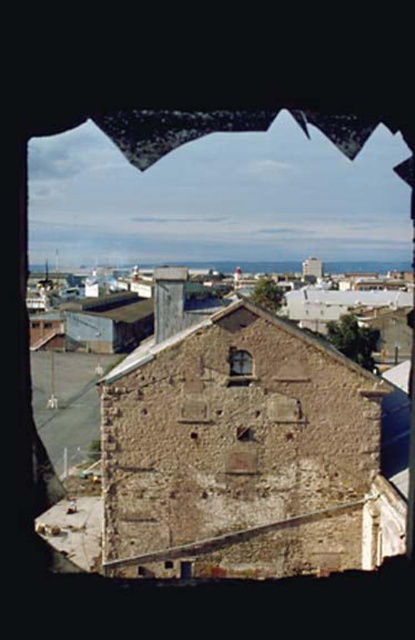
Is matte glass window at center thinner than rusty metal hole at center?

No.

Image resolution: width=415 pixels, height=640 pixels. What do you see at coordinates (239, 362) in the screenshot? I see `matte glass window at center` at bounding box center [239, 362].

Who is more forward, (248, 355) or (246, 433)?

Point (246, 433)

Locate an element on the screen. Image resolution: width=415 pixels, height=640 pixels. matte glass window at center is located at coordinates (239, 362).